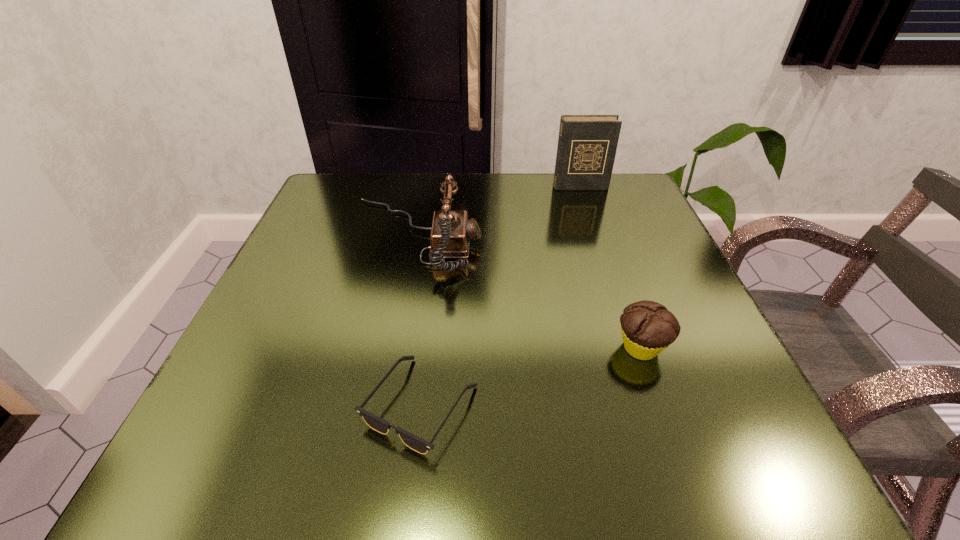
The height and width of the screenshot is (540, 960). I want to click on the farthest object, so click(587, 144).

Find the location of a particular element. This screenshot has width=960, height=540. the tallest object is located at coordinates (587, 144).

This screenshot has width=960, height=540. What are the coordinates of `the second farthest object` in the screenshot? It's located at (451, 233).

The height and width of the screenshot is (540, 960). I want to click on the second tallest object, so click(x=451, y=233).

At what (x,y) coordinates should I click in order to perform the action: click on muffin. Please return your answer as a coordinate pair (x, y). Looking at the image, I should click on (647, 327).

The height and width of the screenshot is (540, 960). I want to click on sunglasses, so click(x=414, y=442).

At what (x,y) coordinates should I click in order to perform the action: click on free region located 0.210m on the front cover of the farthest object. Please return your answer as a coordinate pair (x, y). The width and height of the screenshot is (960, 540). Looking at the image, I should click on pyautogui.click(x=598, y=242).

Locate an element on the screen. The image size is (960, 540). free space located 0.320m on the dial of the telephone is located at coordinates (635, 237).

Find the location of a particular element. This screenshot has height=540, width=960. blank space located on the left of the muffin is located at coordinates (475, 348).

Where is `diary present at the far edge`? This screenshot has width=960, height=540. diary present at the far edge is located at coordinates (587, 144).